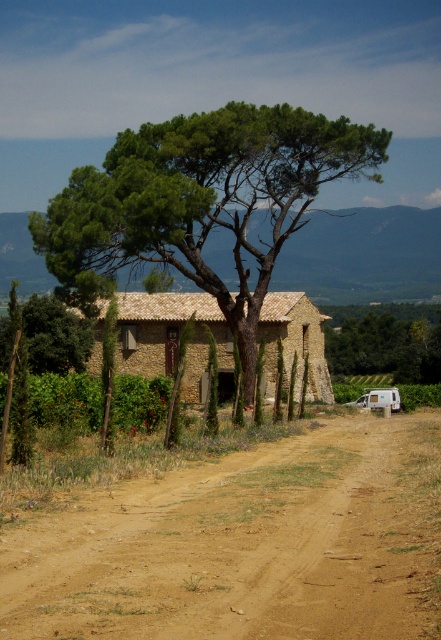
You are standing at the entrance of the rustic stone house and want to take a photo of the brown dirt track at center. Where should you position yourself to capture it in the frame?

To capture the brown dirt track at center in your photo, position yourself at the entrance of the rustic stone house and aim your camera towards the center of the scene, as the brown dirt track at center is located at the central area marked by coordinates 0.852 on the x axis and 0.553 on the y axis.

You are standing at the center of the image and want to walk towards the brown stone house at center. Based on its position at point 0.525, 0.383, in which direction should you move?

The brown stone house at center is located at coordinates (168, 336), which means it is slightly to the right and above the center point. Therefore, you should move towards the upper right direction to reach it.